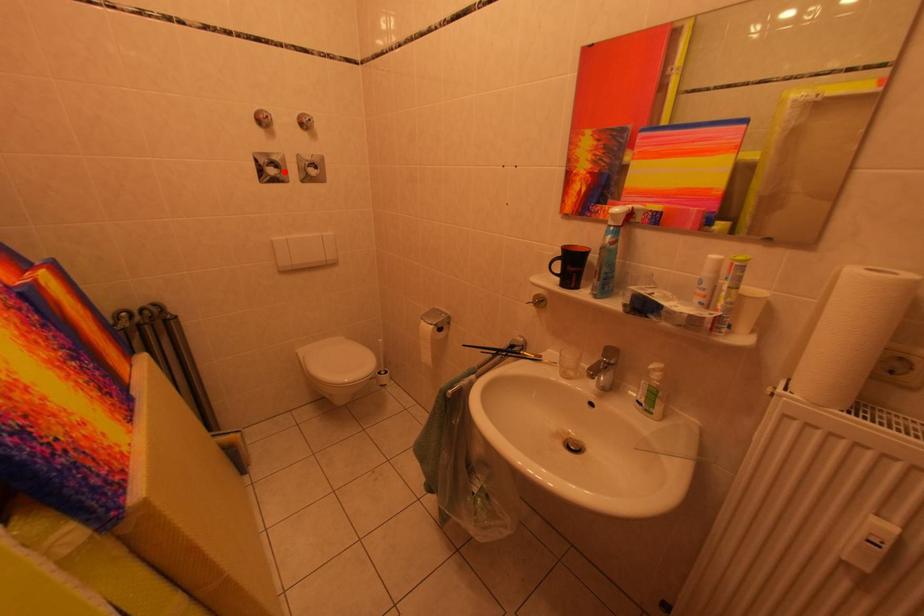
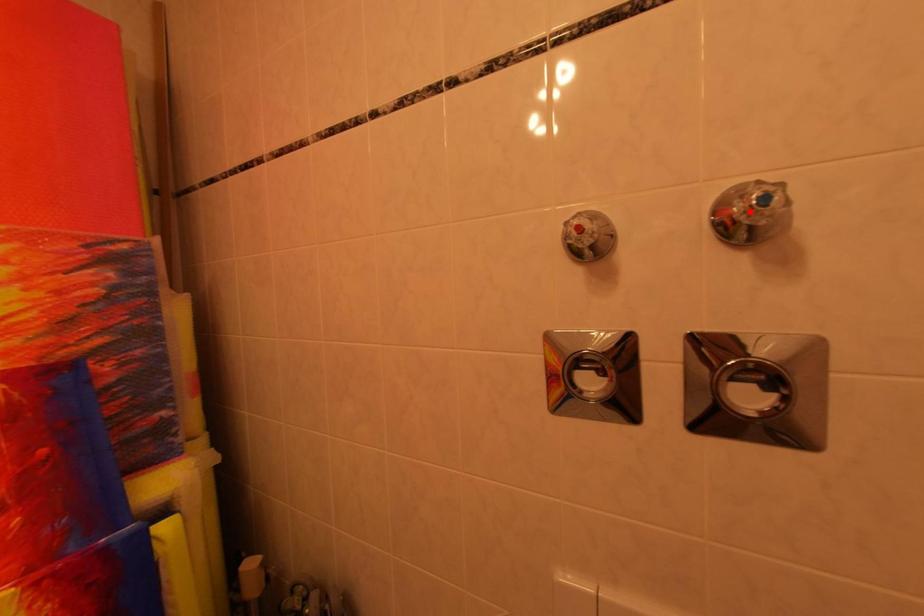
I am providing you with two images of the same scene from different viewpoints. A red point is marked on the first image and another point is marked on the second image. Is the red point in image1 aligned with the point shown in image2?

No